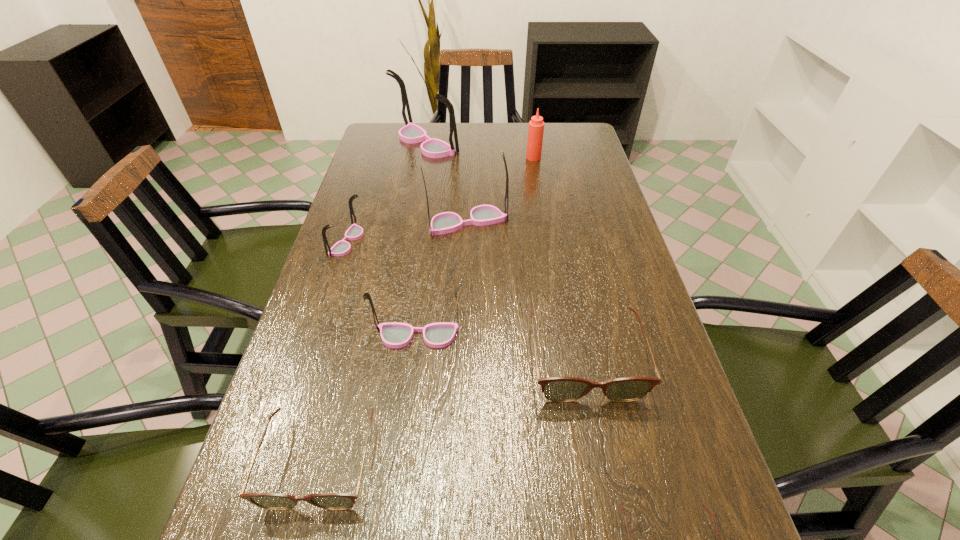
The width and height of the screenshot is (960, 540). Identify the location of the tallest object. (411, 133).

Image resolution: width=960 pixels, height=540 pixels. I want to click on the tallest spectacles, so click(411, 133).

Find the location of a particular element. The image size is (960, 540). the second tallest spectacles is located at coordinates (447, 222).

The image size is (960, 540). Identify the location of Tabasco sauce. (536, 126).

What are the coordinates of `the fifth shortest object` in the screenshot? It's located at (394, 334).

Find the location of `the third tallest spectacles`. the third tallest spectacles is located at coordinates (394, 334).

Where is `the leftmost pink spectacles`? The width and height of the screenshot is (960, 540). the leftmost pink spectacles is located at coordinates (354, 232).

Find the location of a particular element. The width and height of the screenshot is (960, 540). the fifth tallest object is located at coordinates (354, 232).

Identify the location of the farthest brown spectacles. (559, 389).

Identify the location of the biggest brown spectacles. (559, 389).